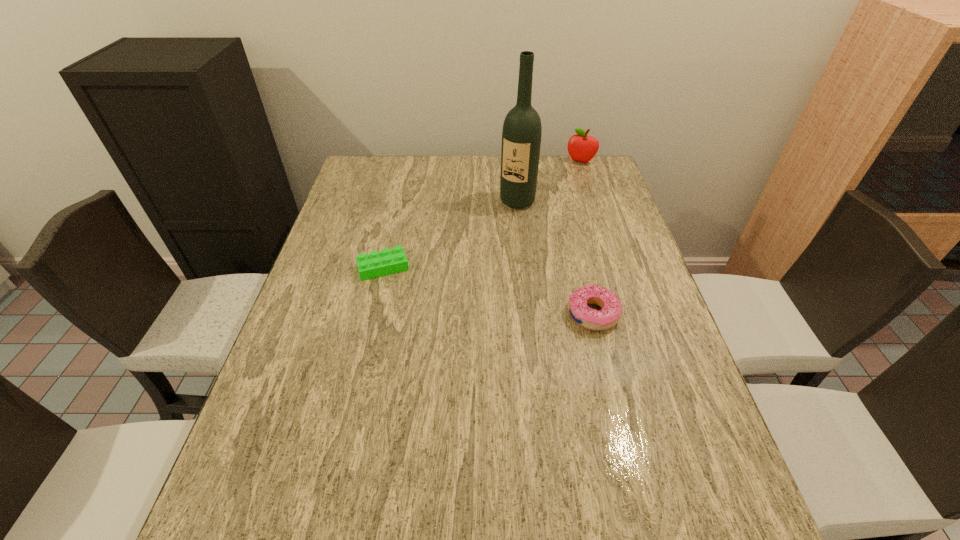
Identify the location of the second nearest object. Image resolution: width=960 pixels, height=540 pixels. (388, 261).

Locate an element on the screen. This screenshot has height=540, width=960. the leftmost object is located at coordinates (388, 261).

Locate an element on the screen. This screenshot has height=540, width=960. doughnut is located at coordinates (610, 314).

At what (x,y) coordinates should I click in order to perform the action: click on wine bottle. Please return your answer as a coordinate pair (x, y). The width and height of the screenshot is (960, 540). Looking at the image, I should click on (521, 136).

Identify the location of the tallest object. (521, 136).

Image resolution: width=960 pixels, height=540 pixels. In order to click on the farthest object in this screenshot , I will do `click(582, 148)`.

Locate an element on the screen. This screenshot has width=960, height=540. apple is located at coordinates [582, 148].

At what (x,y) coordinates should I click in order to perform the action: click on free location located on the back of the Lego. Please return your answer as a coordinate pair (x, y). The image size is (960, 540). Looking at the image, I should click on (402, 186).

This screenshot has height=540, width=960. I want to click on vacant space located on the left of the nearest object, so click(x=426, y=314).

Locate an element on the screen. This screenshot has width=960, height=540. free spot located on the labeled side of the tallest object is located at coordinates (478, 262).